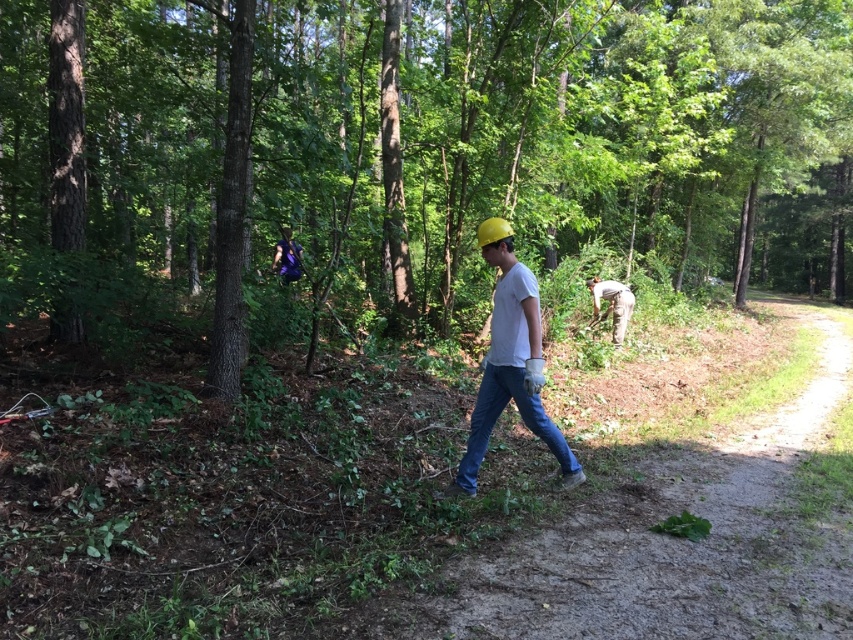
Question: Is smooth dirt path at center above blue denim jeans at center?

Choices:
 (A) yes
 (B) no

Answer: (B)

Question: Can you confirm if blue denim jeans at center is bigger than purple fabric backpack at center?

Choices:
 (A) no
 (B) yes

Answer: (A)

Question: Which point is farther to the camera?

Choices:
 (A) (479, 584)
 (B) (618, 344)
 (C) (82, 129)

Answer: (B)

Question: Which point is closer to the camera taking this photo?

Choices:
 (A) (494, 316)
 (B) (625, 305)
 (C) (294, 250)
 (D) (535, 410)

Answer: (A)

Question: Is green leafy tree at center smaller than camouflage pants at center?

Choices:
 (A) no
 (B) yes

Answer: (A)

Question: Estimate the real-world distances between objects in this image. Which object is closer to the smooth dirt path at center?

Choices:
 (A) blue denim jeans at center
 (B) purple fabric backpack at center
 (C) camouflage pants at center

Answer: (A)